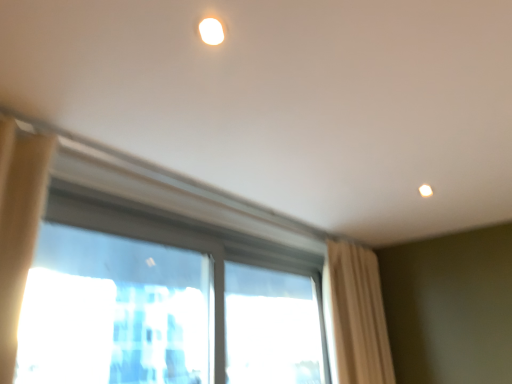
Question: From the image's perspective, is transparent glass window at center over transparent glass window at center, the second window positioned from the right?

Choices:
 (A) no
 (B) yes

Answer: (B)

Question: Considering the relative sizes of transparent glass window at center and transparent glass window at center, acting as the 1th window starting from the left, in the image provided, is transparent glass window at center bigger than transparent glass window at center, acting as the 1th window starting from the left,?

Choices:
 (A) no
 (B) yes

Answer: (B)

Question: Is transparent glass window at center further to the viewer compared to transparent glass window at center, acting as the 1th window starting from the left?

Choices:
 (A) yes
 (B) no

Answer: (B)

Question: Is transparent glass window at center facing away from transparent glass window at center, the second window positioned from the right?

Choices:
 (A) yes
 (B) no

Answer: (A)

Question: Considering the relative positions of transparent glass window at center and transparent glass window at center, the second window positioned from the right, in the image provided, is transparent glass window at center in front of transparent glass window at center, the second window positioned from the right,?

Choices:
 (A) no
 (B) yes

Answer: (B)

Question: Is transparent glass window at center, acting as the 1th window starting from the right, in front of or behind transparent glass window at center, acting as the 1th window starting from the left, in the image?

Choices:
 (A) behind
 (B) front

Answer: (A)

Question: Based on their sizes in the image, would you say transparent glass window at center, marked as the 2th window in a left-to-right arrangement, is bigger or smaller than transparent glass window at center, the second window positioned from the right?

Choices:
 (A) small
 (B) big

Answer: (B)

Question: Is transparent glass window at center, marked as the 2th window in a left-to-right arrangement, wider or thinner than transparent glass window at center, the second window positioned from the right?

Choices:
 (A) wide
 (B) thin

Answer: (A)

Question: From the image's perspective, is transparent glass window at center, marked as the 2th window in a left-to-right arrangement, located above or below transparent glass window at center, the second window positioned from the right?

Choices:
 (A) above
 (B) below

Answer: (B)

Question: Is beige fabric curtain at right inside the boundaries of transparent glass window at center, marked as the 2th window in a left-to-right arrangement, or outside?

Choices:
 (A) inside
 (B) outside

Answer: (B)

Question: In the image, is beige fabric curtain at right positioned in front of or behind transparent glass window at center, marked as the 2th window in a left-to-right arrangement?

Choices:
 (A) behind
 (B) front

Answer: (A)

Question: In terms of width, does beige fabric curtain at right look wider or thinner when compared to transparent glass window at center, acting as the 1th window starting from the right?

Choices:
 (A) wide
 (B) thin

Answer: (A)

Question: Is beige fabric curtain at right bigger or smaller than transparent glass window at center, marked as the 2th window in a left-to-right arrangement?

Choices:
 (A) small
 (B) big

Answer: (B)

Question: Does point (251, 312) appear closer or farther from the camera than point (45, 334)?

Choices:
 (A) closer
 (B) farther

Answer: (A)

Question: Would you say transparent glass window at center, the second window positioned from the right, is to the left or to the right of transparent glass window at center in the picture?

Choices:
 (A) left
 (B) right

Answer: (B)